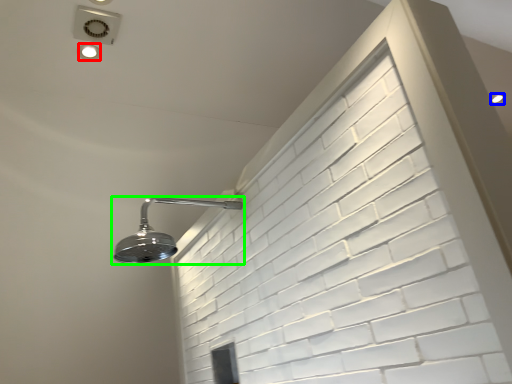
Question: Based on their relative distances, which object is nearer to droplight (highlighted by a red box)? Choose from droplight (highlighted by a blue box) and shower (highlighted by a green box).

Choices:
 (A) droplight
 (B) shower

Answer: (B)